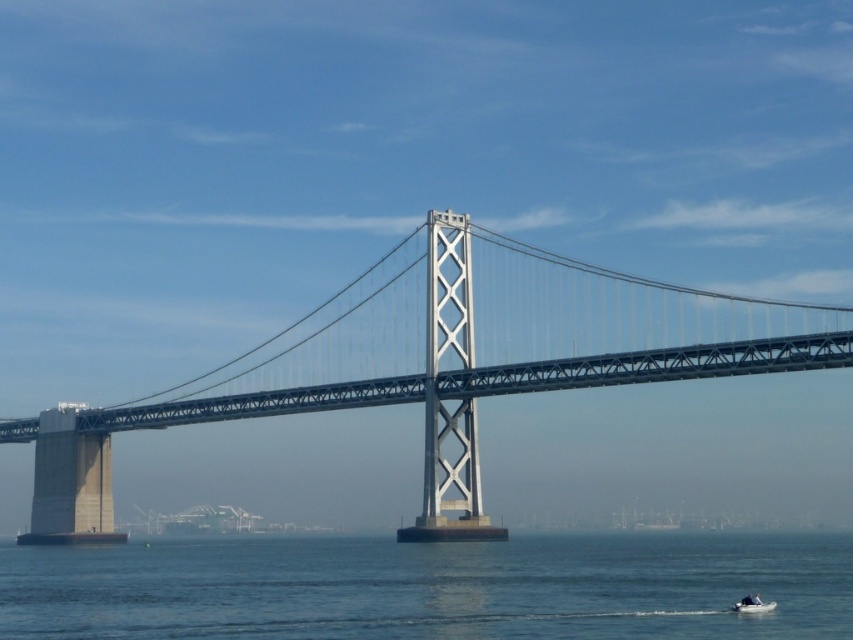
You are a drone operator tasked with capturing aerial footage of the San Francisco Bay Bridge. Your drone has a maximum flight range of 20 meters. If you are currently positioned at the metallic gray bridge at center, can you safely fly your drone to the blue water at lower center without exceeding its range?

The distance between the metallic gray bridge at center and the blue water at lower center is 22.49 meters. Since the drone has a maximum range of 20 meters, it cannot safely reach the blue water at lower center without exceeding its limit.

You are a photographer planning to capture the iconic San Francisco Oakland Bay Bridge. You want to ensure the metallic gray bridge at center is perfectly centered in your photo. According to the coordinates provided, is the point at (439, 364) the exact center of the metallic gray bridge at center?

Yes, the point at (439, 364) is the exact center of the metallic gray bridge at center as stated in the description.

You are standing on the San Francisco side of the Bay Bridge and looking towards Oakland. You see two points marked on the bridge structure. The first point is at coordinates point (438, 388) and the second is at point (773, 602). Which point is closer to your current position?

Point (438, 388) is closer to your current position because it is further to the camera than point (773, 602), meaning it is physically nearer to where you are standing.